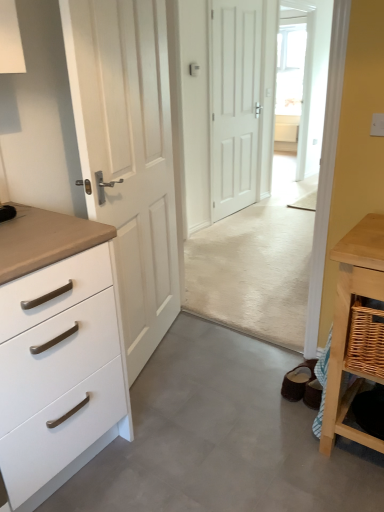
In order to face woven wood table at right, should I rotate leftwards or rightwards?

A 18.547 degree turn to the right will do.

Where is `white matte chest of drawers at left`? The height and width of the screenshot is (512, 384). white matte chest of drawers at left is located at coordinates (57, 351).

In order to face white matte door at center, the first door positioned from the back, should I rotate leftwards or rightwards?

To align with it, rotate right about 6.622°.

This screenshot has width=384, height=512. In order to click on woven wood basket at lower right in this screenshot , I will do `click(366, 341)`.

Is woven wood table at right far away from white matte door at center, positioned as the second door in front-to-back order?

Yes.

Considering the relative positions of woven wood table at right and white matte door at center, marked as the 2th door in a left-to-right arrangement, in the image provided, is woven wood table at right to the right of white matte door at center, marked as the 2th door in a left-to-right arrangement, from the viewer's perspective?

Correct, you'll find woven wood table at right to the right of white matte door at center, marked as the 2th door in a left-to-right arrangement.

Is woven wood table at right looking in the opposite direction of white matte door at center, which is the 1th door in right-to-left order?

No, woven wood table at right is not facing away from white matte door at center, which is the 1th door in right-to-left order.

The height and width of the screenshot is (512, 384). I want to click on the 1st door to the left when counting from the woven wood table at right, so click(x=235, y=104).

Is white matte door at center, marked as the 2th door in a left-to-right arrangement, closer to the viewer compared to white wood door at left, positioned as the 1th door in left-to-right order?

No, white matte door at center, marked as the 2th door in a left-to-right arrangement, is further to the viewer.

Which of these two, white matte door at center, positioned as the second door in front-to-back order, or white wood door at left, positioned as the second door in back-to-front order, is bigger?

With larger size is white wood door at left, positioned as the second door in back-to-front order.

Is white matte door at center, positioned as the second door in front-to-back order, taller than white wood door at left, which ranks as the first door in front-to-back order?

Correct, white matte door at center, positioned as the second door in front-to-back order, is much taller as white wood door at left, which ranks as the first door in front-to-back order.

From the image's perspective, between white matte door at center, the first door positioned from the back, and white wood door at left, arranged as the second door when viewed from the right, which one is located above?

white matte door at center, the first door positioned from the back.

Considering the points (302, 159) and (368, 355), which point is behind, point (302, 159) or point (368, 355)?

Positioned behind is point (302, 159).

In the scene shown: Are transparent glass door at upper center and woven wood table at right located far from each other?

Absolutely, transparent glass door at upper center is distant from woven wood table at right.

Between transparent glass door at upper center and woven wood table at right, which one has smaller size?

woven wood table at right is smaller.

Based on the photo, is transparent glass door at upper center not within woven wood table at right?

Indeed, transparent glass door at upper center is completely outside woven wood table at right.

Is woven wood table at right positioned far away from white matte chest of drawers at left?

woven wood table at right is near white matte chest of drawers at left, not far away.

From their relative heights in the image, would you say woven wood table at right is taller or shorter than white matte chest of drawers at left?

woven wood table at right is shorter than white matte chest of drawers at left.

Considering their positions, is woven wood table at right located in front of or behind white matte chest of drawers at left?

woven wood table at right is behind white matte chest of drawers at left.

Which is behind, point (332, 381) or point (126, 375)?

Point (126, 375)

Does point (6, 429) appear closer or farther from the camera than point (140, 78)?

Point (6, 429) is closer to the camera than point (140, 78).

From a real-world perspective, who is located lower, white matte chest of drawers at left or white wood door at left, positioned as the 1th door in left-to-right order?

white matte chest of drawers at left is physically lower.

Between white matte chest of drawers at left and white wood door at left, which ranks as the first door in front-to-back order, which one appears on the left side from the viewer's perspective?

white matte chest of drawers at left is more to the left.

Is woven wood basket at lower right turned away from white matte chest of drawers at left?

No, woven wood basket at lower right is not facing the opposite direction of white matte chest of drawers at left.

Does woven wood basket at lower right appear on the right side of white matte chest of drawers at left?

Correct, you'll find woven wood basket at lower right to the right of white matte chest of drawers at left.

Is woven wood basket at lower right positioned before white matte chest of drawers at left?

No.

Can we say woven wood basket at lower right lies outside white matte chest of drawers at left?

Yes.

From the picture: Is woven wood basket at lower right oriented towards white wood door at left, which ranks as the first door in front-to-back order?

No, woven wood basket at lower right does not turn towards white wood door at left, which ranks as the first door in front-to-back order.

From the image's perspective, is woven wood basket at lower right located above or below white wood door at left, arranged as the second door when viewed from the right?

From the image's perspective, woven wood basket at lower right appears below white wood door at left, arranged as the second door when viewed from the right.

Consider the image. Considering the relative positions of woven wood basket at lower right and white wood door at left, positioned as the second door in back-to-front order, in the image provided, is woven wood basket at lower right to the left of white wood door at left, positioned as the second door in back-to-front order, from the viewer's perspective?

No.

Looking at their sizes, would you say woven wood basket at lower right is wider or thinner than white wood door at left, positioned as the 1th door in left-to-right order?

In the image, woven wood basket at lower right appears to be wider than white wood door at left, positioned as the 1th door in left-to-right order.

At what (x,y) coordinates should I click in order to perform the action: click on door lying behind the woven wood table at right. Please return your answer as a coordinate pair (x, y). The image size is (384, 512). Looking at the image, I should click on (235, 104).

Find the location of a particular element. This screenshot has width=384, height=512. door that appears on the right of white wood door at left, arranged as the second door when viewed from the right is located at coordinates (235, 104).

Based on their spatial positions, is transparent glass door at upper center or white matte door at center, which is the 1th door in right-to-left order, closer to white wood door at left, which ranks as the first door in front-to-back order?

white matte door at center, which is the 1th door in right-to-left order, is closer to white wood door at left, which ranks as the first door in front-to-back order.

From the image, which object appears to be farther from white wood door at left, positioned as the 1th door in left-to-right order, woven wood table at right or transparent glass door at upper center?

The object further to white wood door at left, positioned as the 1th door in left-to-right order, is transparent glass door at upper center.

Considering their positions, is white wood door at left, positioned as the second door in back-to-front order, positioned closer to transparent glass door at upper center than white matte chest of drawers at left?

white wood door at left, positioned as the second door in back-to-front order.

Looking at the image, which one is located closer to white matte door at center, marked as the 2th door in a left-to-right arrangement, woven wood table at right or transparent glass door at upper center?

woven wood table at right is closer to white matte door at center, marked as the 2th door in a left-to-right arrangement.

Based on their spatial positions, is woven wood basket at lower right or white matte door at center, the first door positioned from the back, closer to woven wood table at right?

woven wood basket at lower right.

From the image, which object appears to be nearer to woven wood table at right, transparent glass door at upper center or white matte door at center, the first door positioned from the back?

white matte door at center, the first door positioned from the back, is closer to woven wood table at right.

When comparing their distances from white matte chest of drawers at left, does woven wood table at right or white matte door at center, which is the 1th door in right-to-left order, seem further?

Among the two, white matte door at center, which is the 1th door in right-to-left order, is located further to white matte chest of drawers at left.

Looking at this image, estimate the real-world distances between objects in this image. Which object is closer to white wood door at left, positioned as the 1th door in left-to-right order, white matte chest of drawers at left or woven wood table at right?

white matte chest of drawers at left is closer to white wood door at left, positioned as the 1th door in left-to-right order.

At what (x,y) coordinates should I click in order to perform the action: click on table situated between white matte chest of drawers at left and woven wood basket at lower right from left to right. Please return your answer as a coordinate pair (x, y). This screenshot has height=512, width=384. Looking at the image, I should click on (355, 328).

At what (x,y) coordinates should I click in order to perform the action: click on table between woven wood basket at lower right and white matte door at center, which is the 1th door in right-to-left order, along the z-axis. Please return your answer as a coordinate pair (x, y). Looking at the image, I should click on (355, 328).

I want to click on door between white matte chest of drawers at left and white matte door at center, which is the 1th door in right-to-left order, along the z-axis, so click(128, 154).

You are a GUI agent. You are given a task and a screenshot of the screen. Output one action in this format:
    pyautogui.click(x=<x>, y=<y>)
    Task: Click on the table between white matte chest of drawers at left and white matte door at center, which is the 1th door in right-to-left order, along the z-axis
    
    Given the screenshot: What is the action you would take?
    pyautogui.click(x=355, y=328)